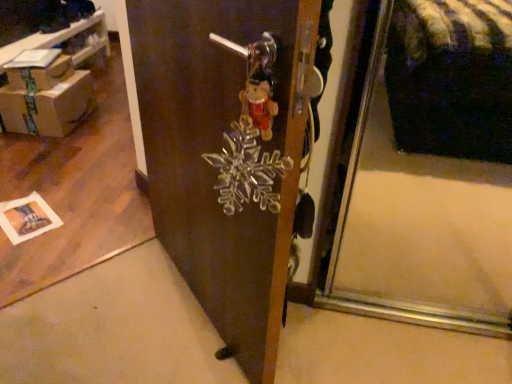
Image resolution: width=512 pixels, height=384 pixels. In order to click on vacant area located to the right-hand side of cardboard box at left in this screenshot , I will do `click(103, 125)`.